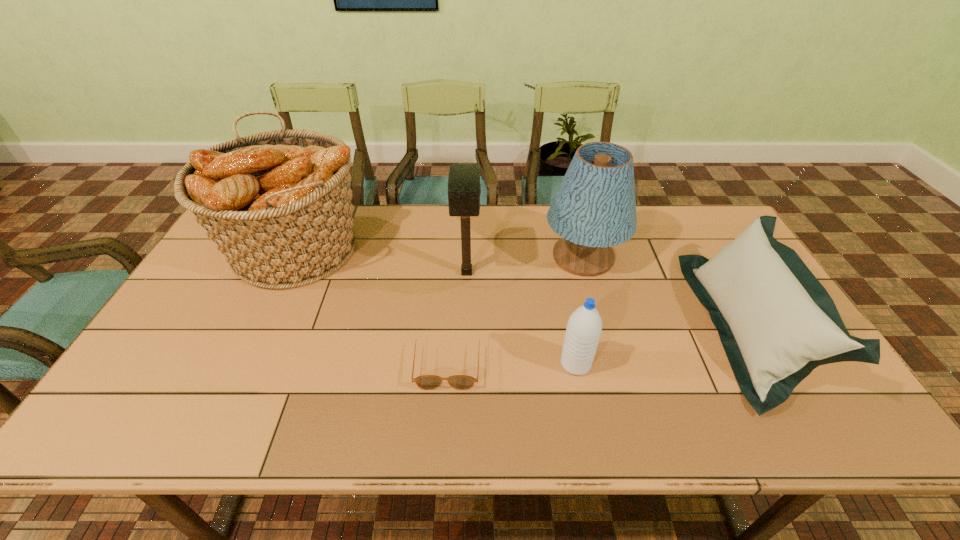
Identify the location of object present at the near right corner. The image size is (960, 540). pos(777,323).

The height and width of the screenshot is (540, 960). In the image, there is a desktop. What are the coordinates of `free space at the far edge` in the screenshot? It's located at (492, 220).

You are a GUI agent. You are given a task and a screenshot of the screen. Output one action in this format:
    pyautogui.click(x=<x>, y=<y>)
    Task: Click on the free space at the near edge
    The height and width of the screenshot is (540, 960).
    Given the screenshot: What is the action you would take?
    pyautogui.click(x=407, y=428)

Identify the location of vacant space at the left edge of the desktop. pos(155,374).

Locate an element on the screen. This screenshot has width=960, height=540. vacant space at the far right corner of the desktop is located at coordinates (696, 224).

Find the location of `vacant area between the sunglasses and the leftmost object`. vacant area between the sunglasses and the leftmost object is located at coordinates (372, 305).

What are the coordinates of `free space between the water bottle and the mallet` in the screenshot? It's located at (521, 318).

I want to click on blank region between the shortest object and the water bottle, so click(512, 363).

Identify the location of free space between the water bottle and the shortest object. The height and width of the screenshot is (540, 960). 512,363.

This screenshot has width=960, height=540. I want to click on vacant area that lies between the rightmost object and the lampshade, so click(665, 292).